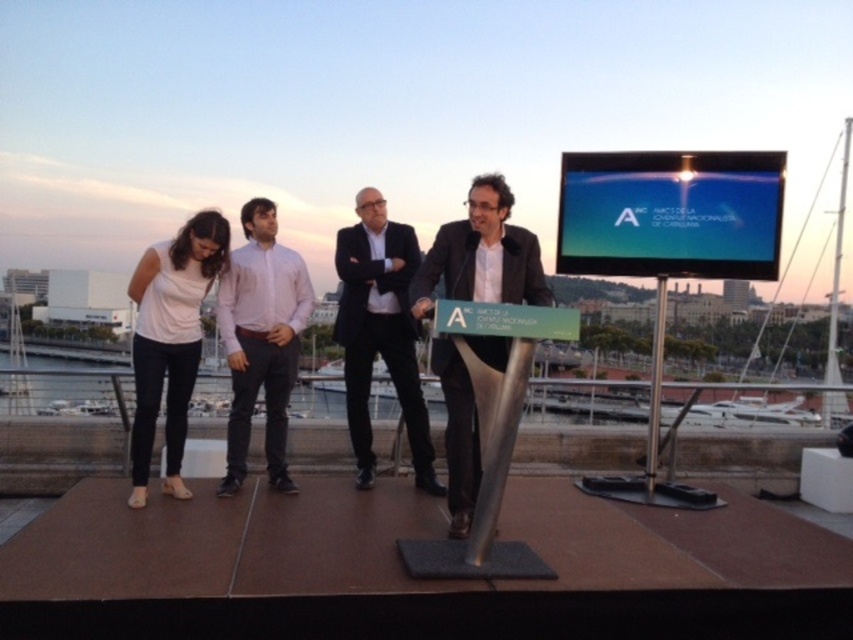
Question: Can you confirm if white matte shirt at left is positioned above dark gray suit at center?

Choices:
 (A) no
 (B) yes

Answer: (B)

Question: Can you confirm if pink cotton shirt at center is positioned to the right of white matte shirt at left?

Choices:
 (A) yes
 (B) no

Answer: (A)

Question: Which of the following is the farthest from the observer?

Choices:
 (A) [x=302, y=284]
 (B) [x=379, y=252]
 (C) [x=137, y=497]

Answer: (B)

Question: Can you confirm if black suit at center is positioned above dark gray suit at center?

Choices:
 (A) yes
 (B) no

Answer: (B)

Question: Which of the following is the closest to the observer?

Choices:
 (A) black suit at center
 (B) white matte shirt at left
 (C) pink cotton shirt at center
 (D) dark gray suit at center

Answer: (D)

Question: Which point is closer to the camera?

Choices:
 (A) black suit at center
 (B) white matte shirt at left
 (C) pink cotton shirt at center
 (D) dark gray suit at center

Answer: (D)